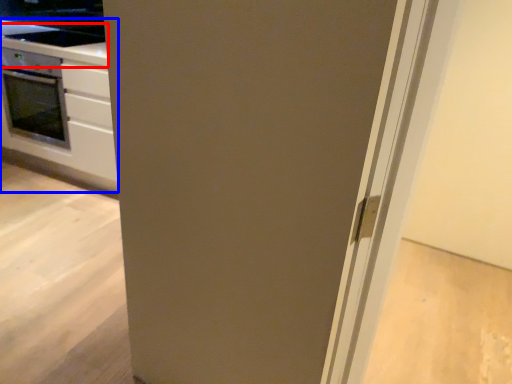
Question: Which object is closer to the camera taking this photo, counter top (highlighted by a red box) or cabinetry (highlighted by a blue box)?

Choices:
 (A) counter top
 (B) cabinetry

Answer: (B)